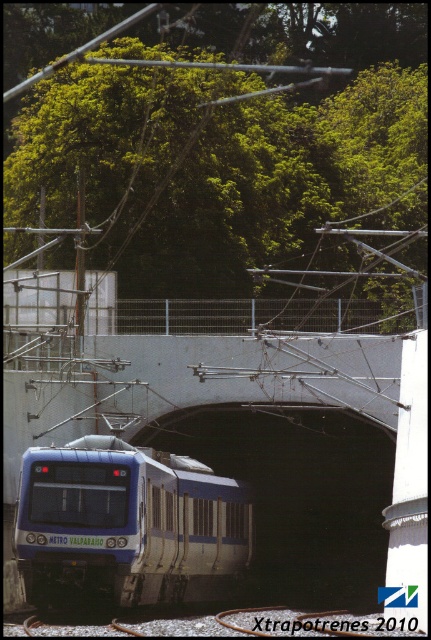
Which is more to the right, green leafy tree at upper center or black smooth tunnel at center?

From the viewer's perspective, black smooth tunnel at center appears more on the right side.

Is point (61, 90) less distant than point (377, 512)?

No, it is behind (377, 512).

Does point (289, 28) come closer to viewer compared to point (349, 416)?

That is False.

Identify the location of green leafy tree at upper center. (231, 147).

Can you confirm if green leafy tree at upper center is wider than blue metallic train at lower left?

Correct, the width of green leafy tree at upper center exceeds that of blue metallic train at lower left.

Which is in front, point (140, 164) or point (83, 451)?

Positioned in front is point (83, 451).

Does point (405, 51) come closer to viewer compared to point (121, 497)?

No, (405, 51) is behind (121, 497).

This screenshot has width=431, height=640. What are the coordinates of `green leafy tree at upper center` in the screenshot? It's located at (231, 147).

Can you confirm if blue metallic train at lower left is wider than black smooth tunnel at center?

No.

Describe the element at coordinates (128, 524) in the screenshot. I see `blue metallic train at lower left` at that location.

Image resolution: width=431 pixels, height=640 pixels. I want to click on blue metallic train at lower left, so click(x=128, y=524).